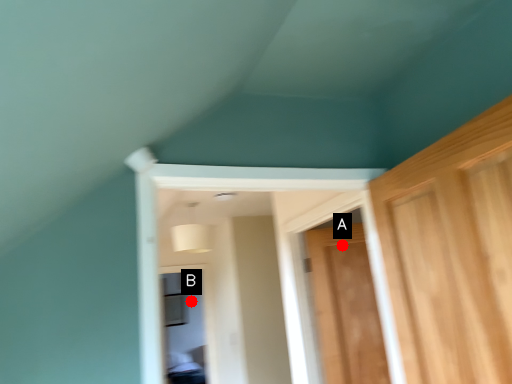
Question: Two points are circled on the image, labeled by A and B beside each circle. Among these points, which one is nearest to the camera?

Choices:
 (A) A is closer
 (B) B is closer

Answer: (A)